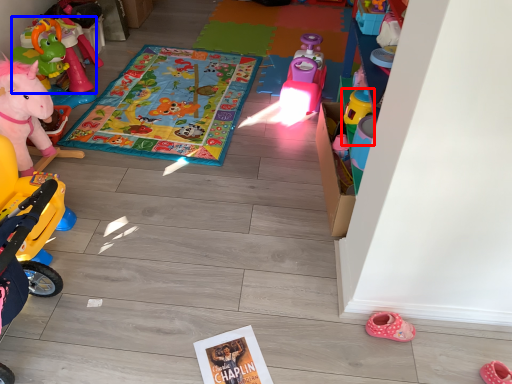
Question: Among these objects, which one is farthest to the camera, toy (highlighted by a red box) or toy (highlighted by a blue box)?

Choices:
 (A) toy
 (B) toy

Answer: (B)